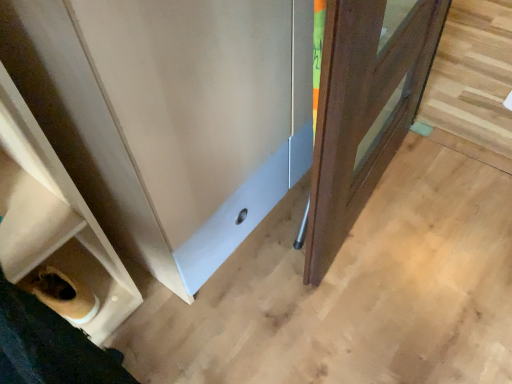
Question: From a real-world perspective, is wooden door at right positioned above or below white matte shelf at lower left?

Choices:
 (A) above
 (B) below

Answer: (B)

Question: Do you think wooden door at right is within white matte shelf at lower left, or outside of it?

Choices:
 (A) inside
 (B) outside

Answer: (B)

Question: Is point (323, 251) positioned closer to the camera than point (33, 119)?

Choices:
 (A) farther
 (B) closer

Answer: (A)

Question: Is white matte shelf at lower left taller or shorter than wooden door at right?

Choices:
 (A) tall
 (B) short

Answer: (A)

Question: Is white matte shelf at lower left bigger or smaller than wooden door at right?

Choices:
 (A) small
 (B) big

Answer: (A)

Question: Based on their positions, is white matte shelf at lower left located to the left or right of wooden door at right?

Choices:
 (A) right
 (B) left

Answer: (B)

Question: Do you think white matte shelf at lower left is within wooden door at right, or outside of it?

Choices:
 (A) inside
 (B) outside

Answer: (B)